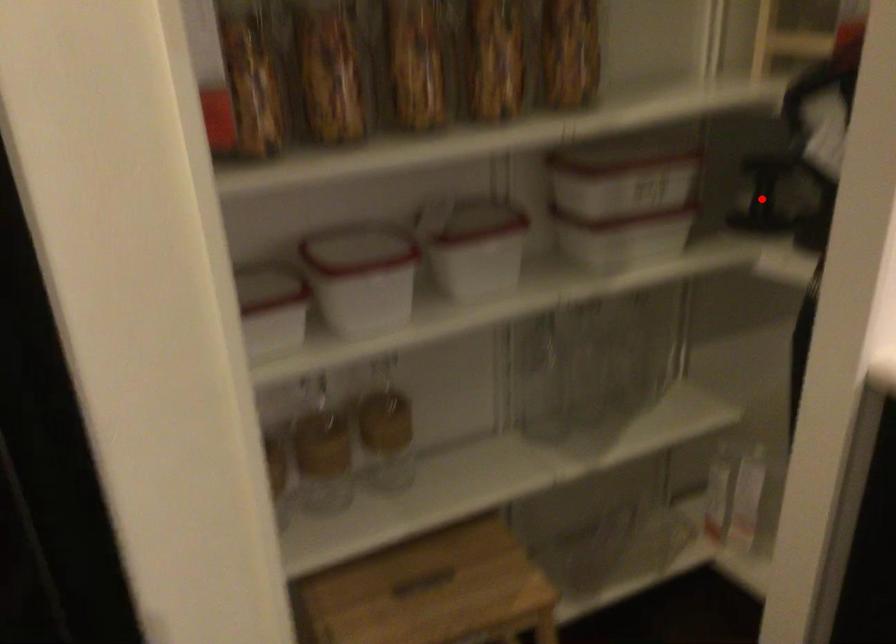
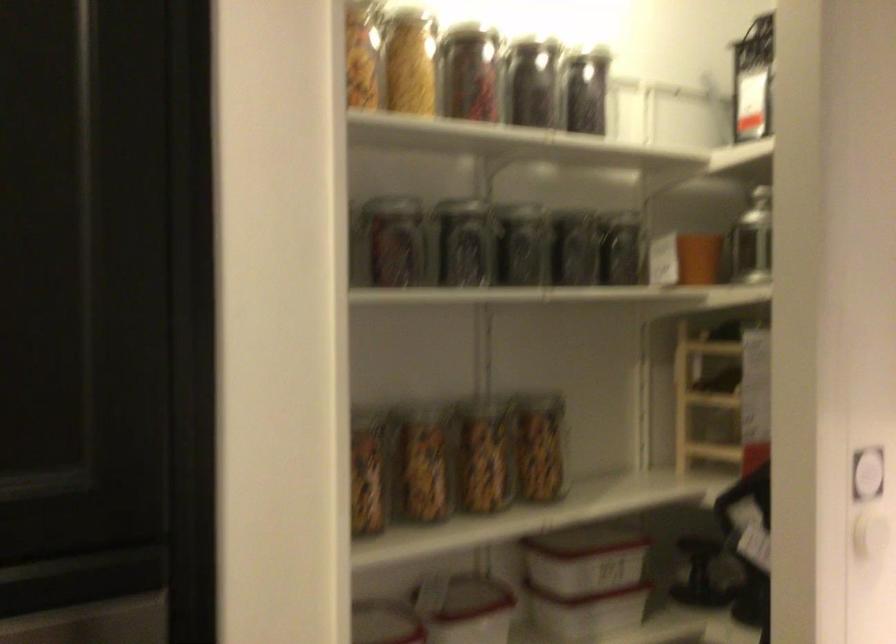
Question: I am providing you with two images of the same scene from different viewpoints. Given a red point in image1, look at the same physical point in image2. Is it:

Choices:
 (A) Closer to the viewpoint
 (B) Farther from the viewpoint

Answer: (B)